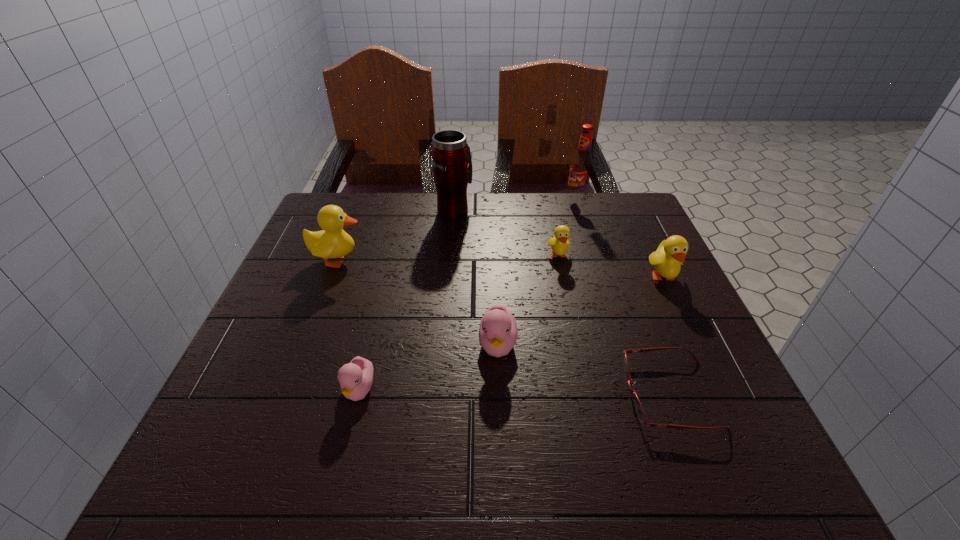
I want to click on thermos bottle, so click(452, 165).

I want to click on red thermos bottle, so click(452, 165).

Locate an element on the screen. root beer is located at coordinates (581, 168).

This screenshot has height=540, width=960. In order to click on the leftmost object in this screenshot , I will do `click(332, 242)`.

At what (x,y) coordinates should I click in order to perform the action: click on the sixth shortest object. Please return your answer as a coordinate pair (x, y). The height and width of the screenshot is (540, 960). Looking at the image, I should click on (332, 242).

I want to click on the rightmost yellow duckling, so click(667, 260).

The height and width of the screenshot is (540, 960). In order to click on the second smallest yellow duckling in this screenshot , I will do point(667,260).

Locate an element on the screen. the bigger pink duckling is located at coordinates (498, 332).

Locate an element on the screen. The height and width of the screenshot is (540, 960). the third duckling from right to left is located at coordinates (498, 332).

Locate an element on the screen. This screenshot has height=540, width=960. the second yellow duckling from right to left is located at coordinates (559, 243).